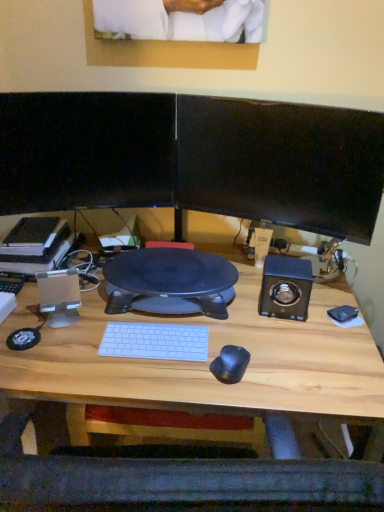
Question: Is wooden desk at center taller than black glossy monitor at upper left, positioned as the first computer monitor in left-to-right order?

Choices:
 (A) no
 (B) yes

Answer: (B)

Question: Is wooden desk at center thinner than black glossy monitor at upper left, positioned as the first computer monitor in left-to-right order?

Choices:
 (A) no
 (B) yes

Answer: (A)

Question: Considering the relative sizes of wooden desk at center and black glossy monitor at upper left, positioned as the first computer monitor in left-to-right order, in the image provided, is wooden desk at center bigger than black glossy monitor at upper left, positioned as the first computer monitor in left-to-right order,?

Choices:
 (A) no
 (B) yes

Answer: (B)

Question: Can you see wooden desk at center touching black glossy monitor at upper left, which is the 2th computer monitor from right to left?

Choices:
 (A) no
 (B) yes

Answer: (A)

Question: Considering the relative positions of wooden desk at center and black glossy monitor at upper left, positioned as the first computer monitor in left-to-right order, in the image provided, is wooden desk at center behind black glossy monitor at upper left, positioned as the first computer monitor in left-to-right order,?

Choices:
 (A) no
 (B) yes

Answer: (A)

Question: Considering the positions of black glossy monitor at upper left, which is the 2th computer monitor from right to left, and wooden desk at center in the image, is black glossy monitor at upper left, which is the 2th computer monitor from right to left, wider or thinner than wooden desk at center?

Choices:
 (A) wide
 (B) thin

Answer: (B)

Question: Is black glossy monitor at upper left, positioned as the first computer monitor in left-to-right order, taller or shorter than wooden desk at center?

Choices:
 (A) short
 (B) tall

Answer: (A)

Question: In the image, is black glossy monitor at upper left, positioned as the first computer monitor in left-to-right order, positioned in front of or behind wooden desk at center?

Choices:
 (A) behind
 (B) front

Answer: (A)

Question: Considering the positions of black glossy monitor at upper left, which is the 2th computer monitor from right to left, and wooden desk at center in the image, is black glossy monitor at upper left, which is the 2th computer monitor from right to left, bigger or smaller than wooden desk at center?

Choices:
 (A) big
 (B) small

Answer: (B)

Question: From the image's perspective, is black glossy monitor at upper left, positioned as the first computer monitor in left-to-right order, above or below black glossy monitor at upper right, which appears as the 1th computer monitor when viewed from the right?

Choices:
 (A) below
 (B) above

Answer: (B)

Question: From a real-world perspective, is black glossy monitor at upper left, which is the 2th computer monitor from right to left, physically located above or below black glossy monitor at upper right, which is the second computer monitor from left to right?

Choices:
 (A) above
 (B) below

Answer: (B)

Question: Is black glossy monitor at upper left, positioned as the first computer monitor in left-to-right order, in front of or behind black glossy monitor at upper right, which appears as the 1th computer monitor when viewed from the right, in the image?

Choices:
 (A) front
 (B) behind

Answer: (B)

Question: Looking at the image, does black glossy monitor at upper left, positioned as the first computer monitor in left-to-right order, seem bigger or smaller compared to black glossy monitor at upper right, which is the second computer monitor from left to right?

Choices:
 (A) small
 (B) big

Answer: (A)

Question: Visually, is black glossy monitor at upper right, which is the second computer monitor from left to right, positioned to the left or to the right of black glossy monitor at upper left, positioned as the first computer monitor in left-to-right order?

Choices:
 (A) right
 (B) left

Answer: (A)

Question: From a real-world perspective, relative to black glossy monitor at upper left, which is the 2th computer monitor from right to left, is black glossy monitor at upper right, which is the second computer monitor from left to right, vertically above or below?

Choices:
 (A) below
 (B) above

Answer: (B)